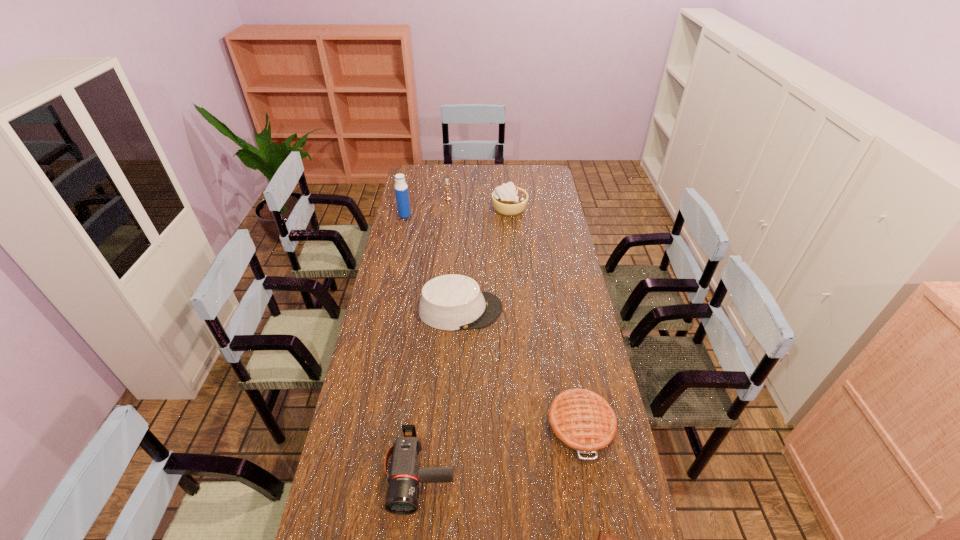
This screenshot has height=540, width=960. Identify the location of vacant region located 0.250m on the front-facing side of the hat. (568, 310).

Where is `free point located on the left of the pie`? The width and height of the screenshot is (960, 540). free point located on the left of the pie is located at coordinates (446, 426).

The width and height of the screenshot is (960, 540). Identify the location of water bottle that is at the left edge. (401, 189).

In order to click on camcorder at the left edge in this screenshot , I will do `click(402, 498)`.

Find the location of a particular element. This screenshot has width=960, height=540. object that is at the right edge is located at coordinates (582, 421).

Image resolution: width=960 pixels, height=540 pixels. Identify the location of vacant space at the far edge of the desktop. (507, 179).

The image size is (960, 540). In the image, there is a desktop. Identify the location of free space at the left edge. (360, 395).

In the image, there is a desktop. Where is `vacant space at the right edge`? Image resolution: width=960 pixels, height=540 pixels. vacant space at the right edge is located at coordinates (565, 226).

This screenshot has height=540, width=960. Find the location of `vacant space at the far left corner of the desktop`. vacant space at the far left corner of the desktop is located at coordinates (430, 176).

The width and height of the screenshot is (960, 540). In the image, there is a desktop. What are the coordinates of `free space at the far right corner` in the screenshot? It's located at (540, 181).